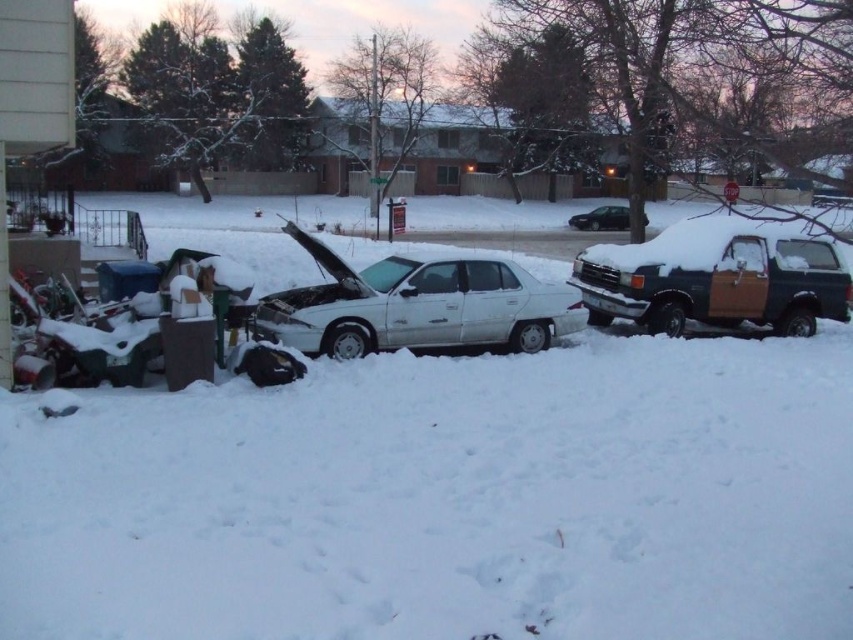
Question: Which object is closer to the camera taking this photo?

Choices:
 (A) black matte sedan at center
 (B) white matte sedan at center

Answer: (B)

Question: Is dark blue wood panel truck at right further to camera compared to black matte sedan at center?

Choices:
 (A) yes
 (B) no

Answer: (B)

Question: Can you confirm if white matte sedan at center is positioned to the left of black matte sedan at center?

Choices:
 (A) yes
 (B) no

Answer: (A)

Question: From the image, what is the correct spatial relationship of white matte sedan at center in relation to dark blue wood panel truck at right?

Choices:
 (A) below
 (B) above

Answer: (B)

Question: Which of these objects is positioned closest to the white matte sedan at center?

Choices:
 (A) black matte sedan at center
 (B) dark blue wood panel truck at right

Answer: (B)

Question: Which object appears closest to the camera in this image?

Choices:
 (A) white matte sedan at center
 (B) black matte sedan at center

Answer: (A)